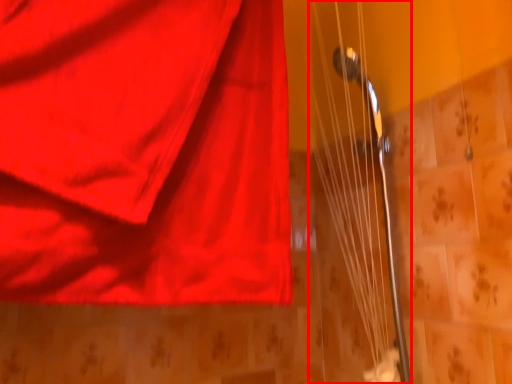
Question: In this image, where is string (annotated by the red box) located relative to curtain?

Choices:
 (A) right
 (B) left

Answer: (A)